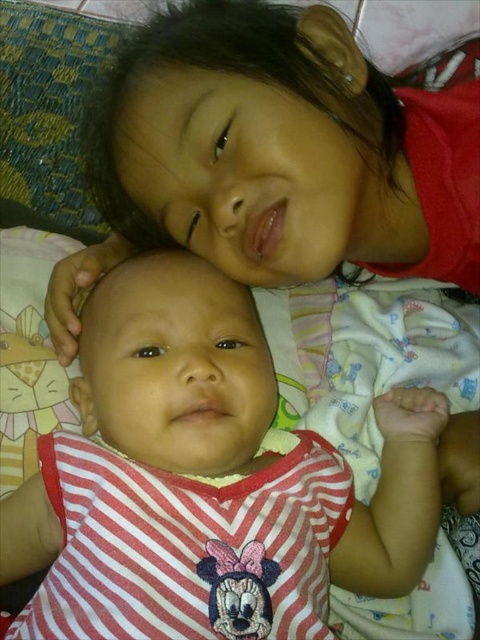
Question: Does red striped fabric at center appear on the left side of matte red shirt at upper center?

Choices:
 (A) no
 (B) yes

Answer: (B)

Question: Where is red striped fabric at center located in relation to matte red shirt at upper center in the image?

Choices:
 (A) above
 (B) below

Answer: (B)

Question: Which point appears farthest from the camera in this image?

Choices:
 (A) (399, 221)
 (B) (120, 440)

Answer: (A)

Question: Among these points, which one is nearest to the camera?

Choices:
 (A) (264, 529)
 (B) (342, 182)

Answer: (A)

Question: Is red striped fabric at center positioned in front of matte red shirt at upper center?

Choices:
 (A) no
 (B) yes

Answer: (B)